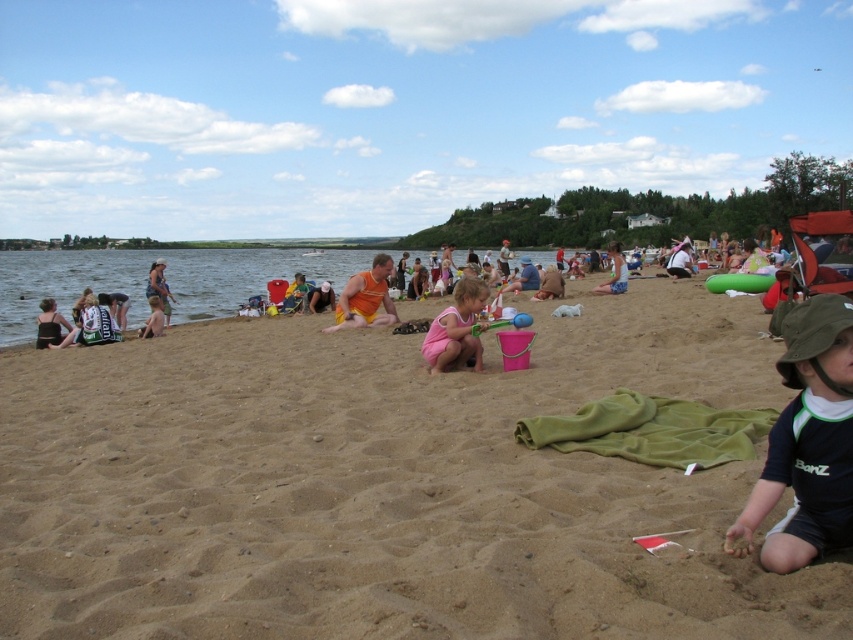
Which is in front, point (112, 257) or point (50, 342)?

Point (50, 342) is more forward.

You are a GUI agent. You are given a task and a screenshot of the screen. Output one action in this format:
    pyautogui.click(x=<x>, y=<y>)
    Task: Click on the clear blue water at center
    This screenshot has height=640, width=853.
    Given the screenshot: What is the action you would take?
    pyautogui.click(x=165, y=275)

Who is higher up, orange fabric shorts at center or green fabric shorts at center?

→ green fabric shorts at center is above.

Does orange fabric shorts at center have a greater height compared to green fabric shorts at center?

Incorrect, orange fabric shorts at center's height is not larger of green fabric shorts at center's.

Who is more distant from viewer, (363,292) or (622,264)?

The point (622,264) is more distant.

This screenshot has width=853, height=640. Find the location of `orange fabric shorts at center`. orange fabric shorts at center is located at coordinates (364, 298).

Is green fleece blanket at center shorter than orange fabric shirt at center?

Yes, green fleece blanket at center is shorter than orange fabric shirt at center.

Who is shorter, green fleece blanket at center or orange fabric shirt at center?

green fleece blanket at center is shorter.

At what (x,y) coordinates should I click in order to perform the action: click on green fleece blanket at center. Please return your answer as a coordinate pair (x, y). The image size is (853, 640). Looking at the image, I should click on (651, 429).